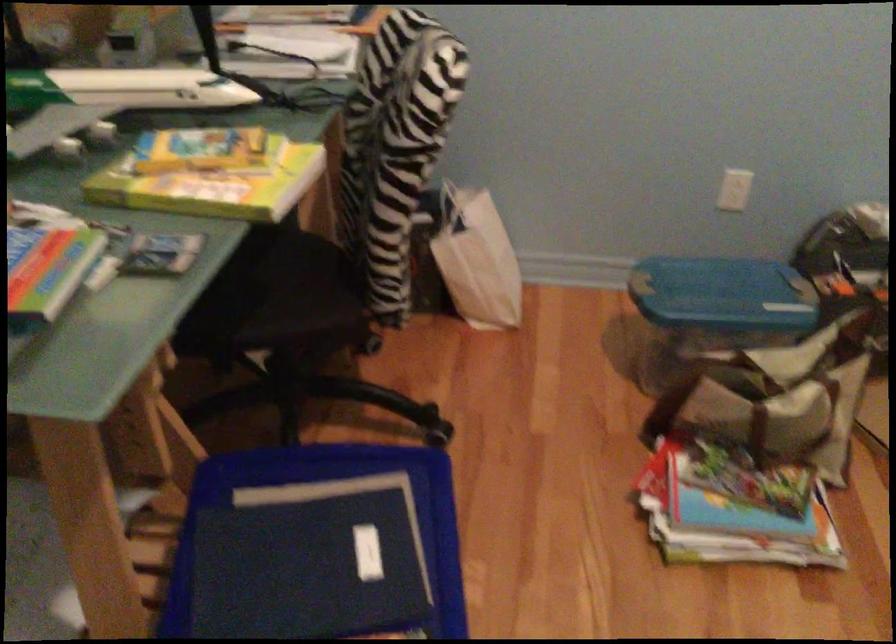
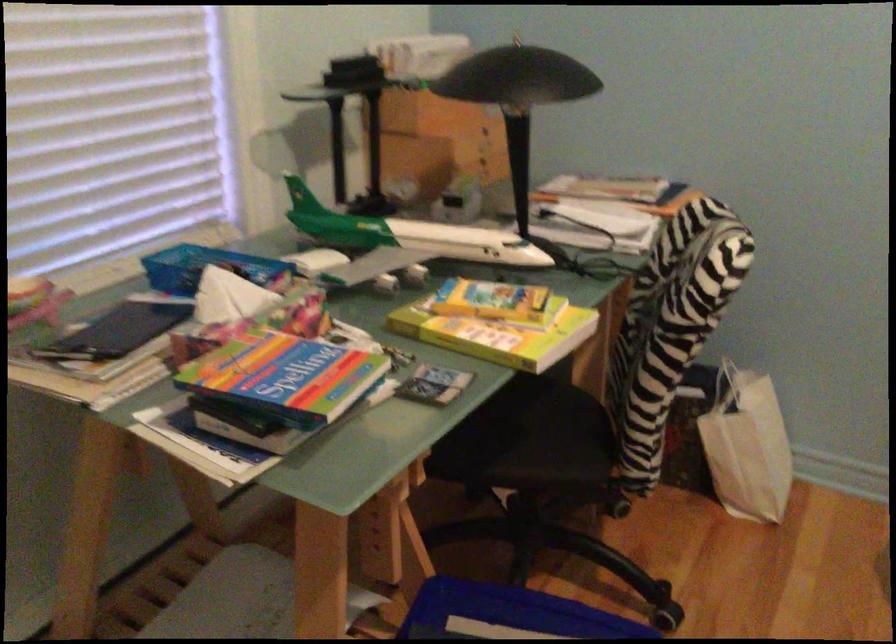
The point at (x=253, y=292) is marked in the first image. Where is the corresponding point in the second image?

(510, 430)